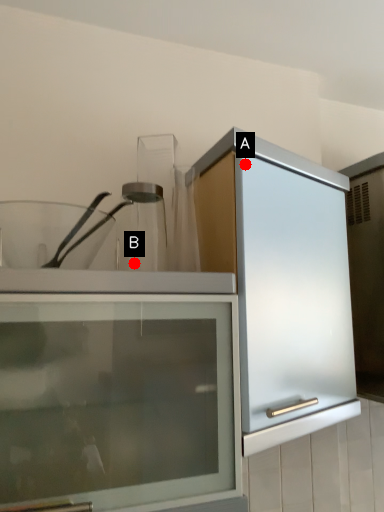
Question: Two points are circled on the image, labeled by A and B beside each circle. Which point is closer to the camera taking this photo?

Choices:
 (A) A is closer
 (B) B is closer

Answer: (A)